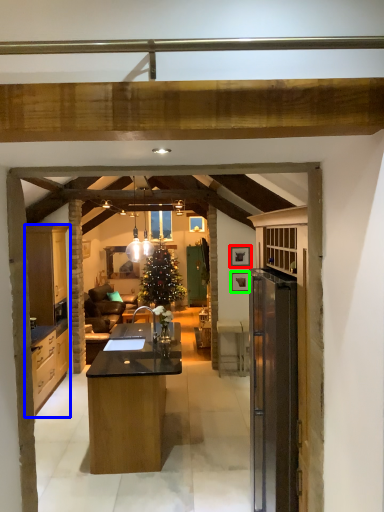
Question: Considering the real-world distances, which object is closest to picture frame (highlighted by a red box)? cabinetry (highlighted by a blue box) or picture frame (highlighted by a green box).

Choices:
 (A) cabinetry
 (B) picture frame

Answer: (B)